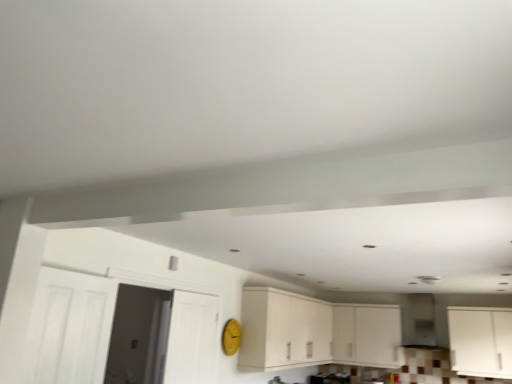
Question: From a real-world perspective, is white matte cabinet at right, the 1th cabinetry positioned from the right, positioned above or below white wooden door at left, the second door viewed from the front?

Choices:
 (A) above
 (B) below

Answer: (A)

Question: In terms of size, does white matte cabinet at right, acting as the third cabinetry starting from the left, appear bigger or smaller than white wooden door at left, which is counted as the second door, starting from the back?

Choices:
 (A) big
 (B) small

Answer: (B)

Question: Which object is the closest to the white wooden door at left, which is counted as the second door, starting from the back?

Choices:
 (A) white matte door at left, the 3th door from the back
 (B) white matte cabinet at right, acting as the third cabinetry starting from the left
 (C) white matte cabinet at center, positioned as the second cabinetry in left-to-right order
 (D) white matte door at left, placed as the 3th door when sorted from front to back
 (E) matte white cabinets at center, acting as the 1th cabinetry starting from the left

Answer: (A)

Question: Estimate the real-world distances between objects in this image. Which object is farther from the white matte door at left, the first door in the front-to-back sequence?

Choices:
 (A) matte white cabinets at center, acting as the third cabinetry starting from the right
 (B) white matte cabinet at center, acting as the second cabinetry starting from the right
 (C) white matte cabinet at right, acting as the third cabinetry starting from the left
 (D) white matte door at left, placed as the 3th door when sorted from front to back
 (E) white wooden door at left, the second door viewed from the front

Answer: (C)